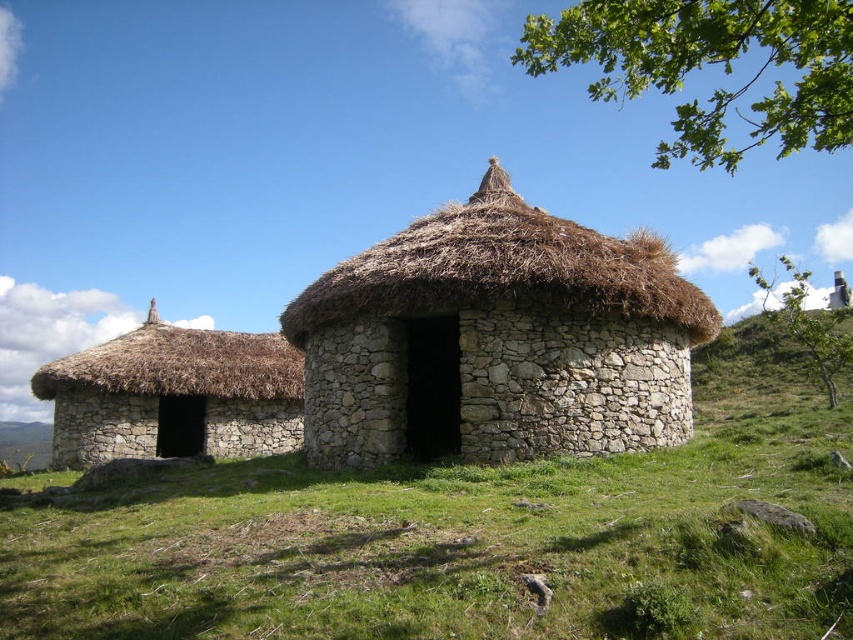
Question: Does stone-thatched hut at center come in front of stone thatched hut at left?

Choices:
 (A) no
 (B) yes

Answer: (B)

Question: Does stone-thatched hut at center have a lesser width compared to stone thatched hut at left?

Choices:
 (A) no
 (B) yes

Answer: (B)

Question: Can you confirm if green leafy branch at upper right is positioned above green leafy tree at upper right?

Choices:
 (A) no
 (B) yes

Answer: (B)

Question: Which point is closer to the camera taking this photo?

Choices:
 (A) (828, 292)
 (B) (741, 154)
 (C) (463, 237)
 (D) (213, 442)

Answer: (C)

Question: Which of the following is the farthest from the observer?

Choices:
 (A) (242, 356)
 (B) (465, 257)

Answer: (A)

Question: Estimate the real-world distances between objects in this image. Which object is closer to the green leafy branch at upper right?

Choices:
 (A) stone thatched hut at left
 (B) green leafy tree at upper right

Answer: (B)